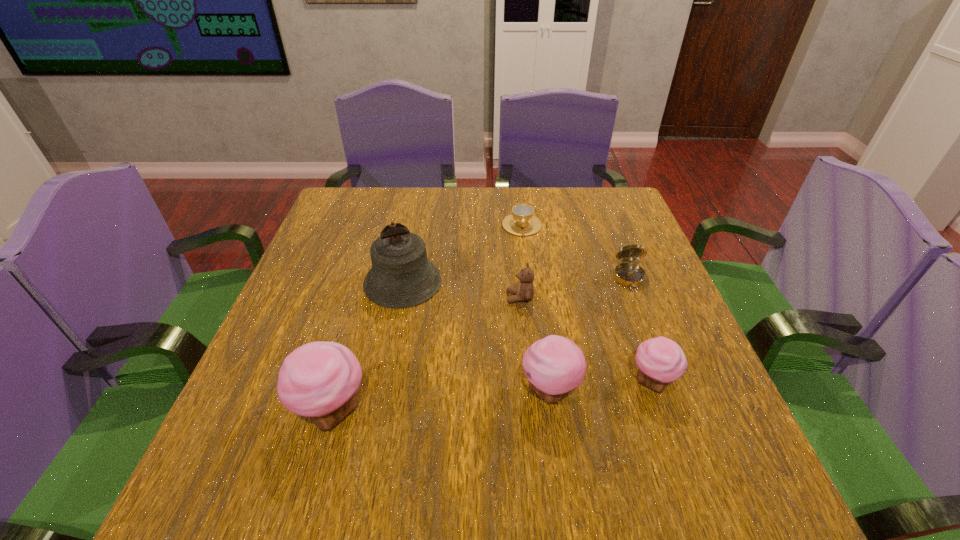
Find the location of a particular element. the tallest cupcake is located at coordinates (319, 380).

Locate an element on the screen. The width and height of the screenshot is (960, 540). the second tallest object is located at coordinates (319, 380).

Find the location of a particular element. This screenshot has width=960, height=540. the second tallest cupcake is located at coordinates (555, 365).

Find the location of a particular element. the second cupcake from left to right is located at coordinates (555, 365).

You are a GUI agent. You are given a task and a screenshot of the screen. Output one action in this format:
    pyautogui.click(x=<x>, y=<y>)
    Task: Click on the rightmost cupcake
    The height and width of the screenshot is (540, 960).
    Given the screenshot: What is the action you would take?
    pyautogui.click(x=660, y=360)

Find the location of a particular element. This screenshot has width=960, height=540. the farthest object is located at coordinates click(x=521, y=222).

At what (x,y) coordinates should I click in order to perform the action: click on the shortest object. Please return your answer as a coordinate pair (x, y). The height and width of the screenshot is (540, 960). Looking at the image, I should click on (521, 222).

Where is `bell`? This screenshot has height=540, width=960. bell is located at coordinates (401, 276).

The image size is (960, 540). In order to click on compass in this screenshot , I will do `click(627, 274)`.

You are a GUI agent. You are given a task and a screenshot of the screen. Output one action in this format:
    pyautogui.click(x=<x>, y=<y>)
    Task: Click on the teddy bear
    
    Given the screenshot: What is the action you would take?
    pyautogui.click(x=524, y=291)